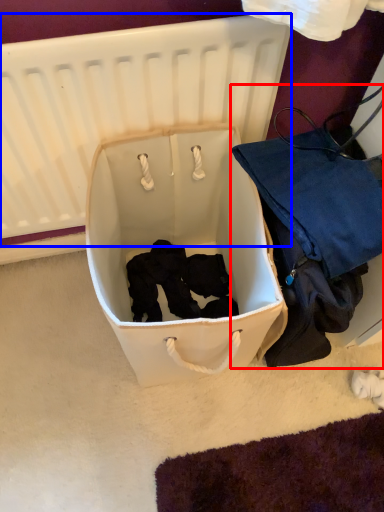
Question: Which object appears closest to the camera in this image, luggage and bags (highlighted by a red box) or infant bed (highlighted by a blue box)?

Choices:
 (A) luggage and bags
 (B) infant bed

Answer: (B)